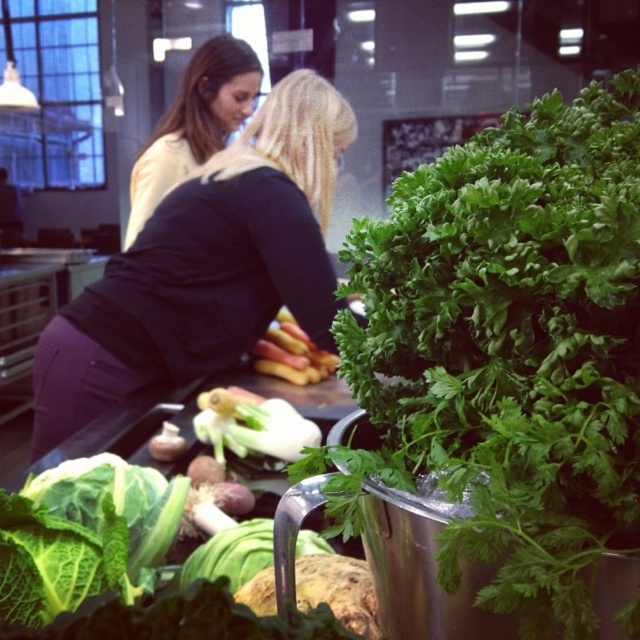
Question: Which is farther from the green leafy vegetable at center?

Choices:
 (A) green leafy parsley at center
 (B) white smooth fennel at center
 (C) blonde hair at upper center
 (D) smooth yellowish-brown potato at center

Answer: (C)

Question: Estimate the real-world distances between objects in this image. Which object is closer to the white smooth fennel at center?

Choices:
 (A) green leafy parsley at center
 (B) smooth yellowish-brown potato at center

Answer: (B)

Question: Which object is the closest to the black matte shirt at upper center?

Choices:
 (A) green leafy vegetable at center
 (B) white smooth fennel at center

Answer: (B)

Question: Is black matte shirt at upper center positioned at the back of white smooth fennel at center?

Choices:
 (A) yes
 (B) no

Answer: (A)

Question: In this image, where is black matte shirt at upper center located relative to smooth yellowish-brown potato at center?

Choices:
 (A) below
 (B) above

Answer: (B)

Question: Is white smooth fennel at center below green leafy vegetable at center?

Choices:
 (A) yes
 (B) no

Answer: (B)